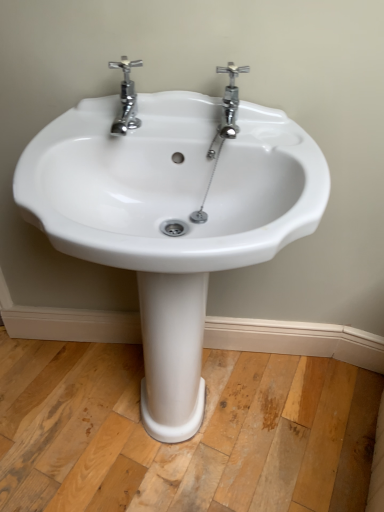
In order to click on free spot to the right of chrome/metallic faucet at upper center, the first tap in the right-to-left sequence in this screenshot , I will do `click(277, 135)`.